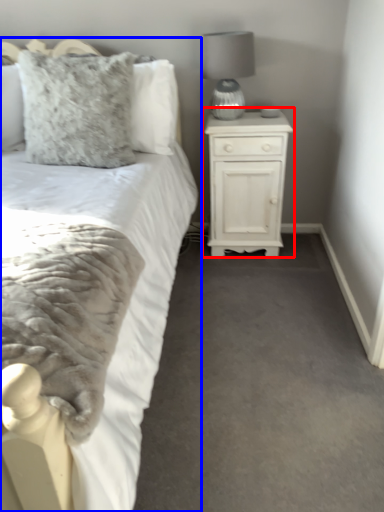
Question: Which of the following is the farthest to the observer, nightstand (highlighted by a red box) or bed (highlighted by a blue box)?

Choices:
 (A) nightstand
 (B) bed

Answer: (A)